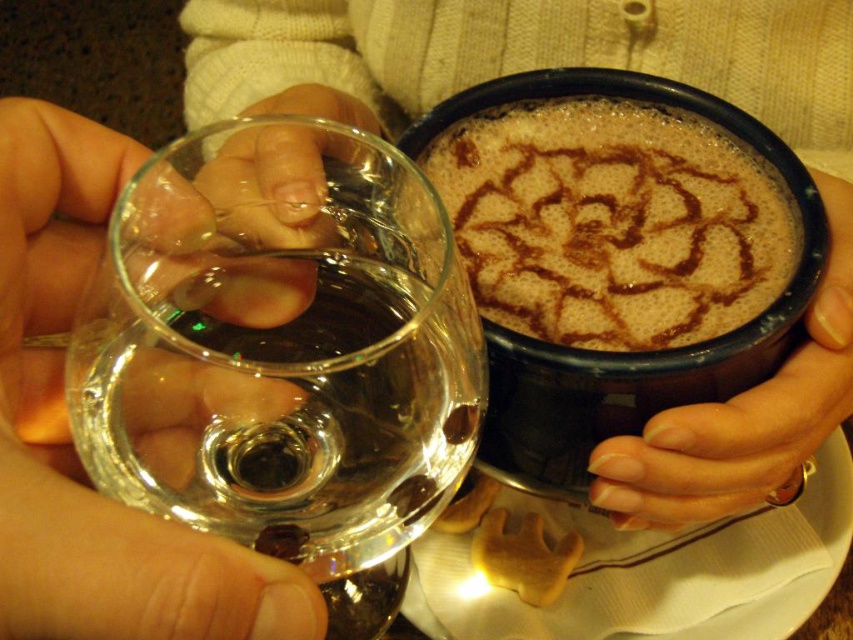
Question: Is transparent glass wine glass at left wider than nail polish on fingernails at right?

Choices:
 (A) no
 (B) yes

Answer: (A)

Question: Considering the real-world distances, which object is farthest from the nail polish on fingernails at right?

Choices:
 (A) brown frothy coffee at upper center
 (B) clear glass wine at left
 (C) transparent glass wine glass at left

Answer: (B)

Question: Is the position of transparent glass wine glass at left less distant than that of clear glass wine at left?

Choices:
 (A) yes
 (B) no

Answer: (A)

Question: Which of these objects is positioned farthest from the transparent glass wine glass at left?

Choices:
 (A) brown frothy coffee at upper center
 (B) clear glass wine at left
 (C) nail polish on fingernails at right

Answer: (B)

Question: Which object is the closest to the nail polish on fingernails at right?

Choices:
 (A) clear glass wine at left
 (B) brown frothy coffee at upper center
 (C) transparent glass wine glass at left

Answer: (B)

Question: From the image, what is the correct spatial relationship of transparent glass wine glass at left in relation to nail polish on fingernails at right?

Choices:
 (A) above
 (B) below

Answer: (B)